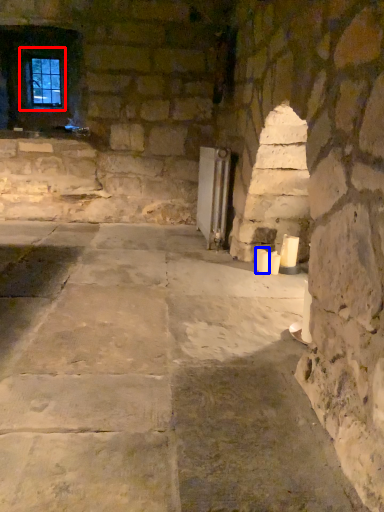
Question: Which point is closer to the camera, window (highlighted by a red box) or candle (highlighted by a blue box)?

Choices:
 (A) window
 (B) candle

Answer: (B)